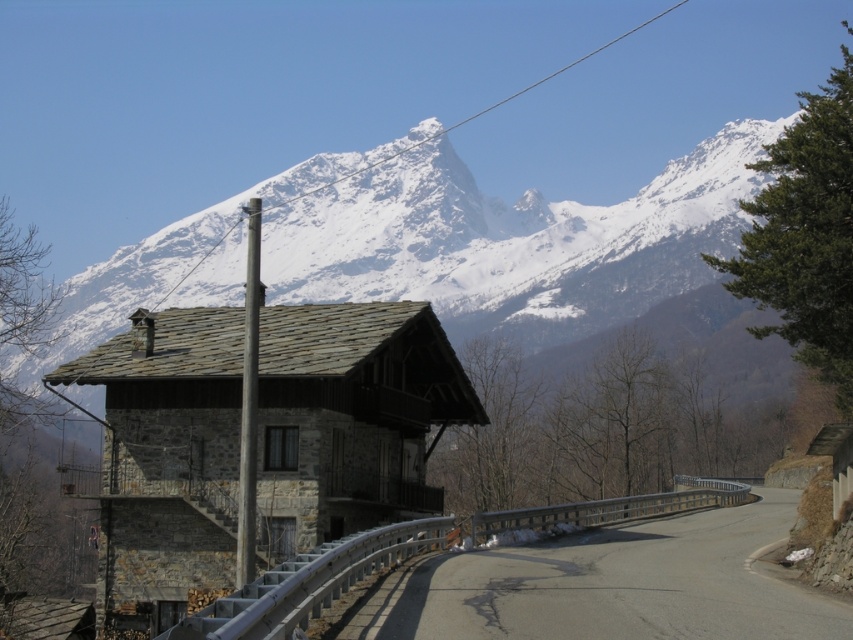
You are driving a car with a 50 meters braking distance and you see the snowy granite mountain range at upper center and the metallic gray pole at center. Which object would you hit first if you lose control and continue moving forward?

The metallic gray pole at center is closer to you than the snowy granite mountain range at upper center, so you would hit the metallic gray pole at center first.

Looking at this image, you are driving along the asphalt road at center and want to reach the snowy granite mountain range at upper center. Based on the scene, which direction should you turn to head towards the mountain range?

The snowy granite mountain range at upper center is positioned over the asphalt road at center, so you should continue straight ahead as the mountain range is directly above the road you are on.